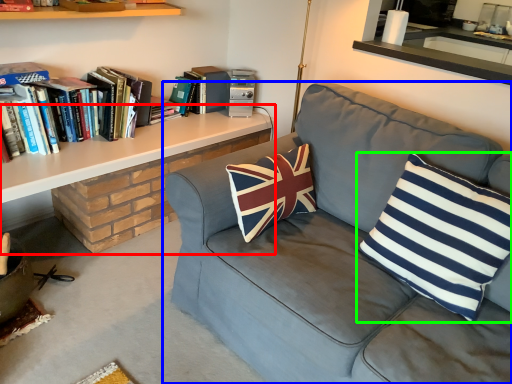
Question: Which object is the farthest from table (highlighted by a red box)? Choose among these: studio couch (highlighted by a blue box) or pillow (highlighted by a green box).

Choices:
 (A) studio couch
 (B) pillow

Answer: (B)